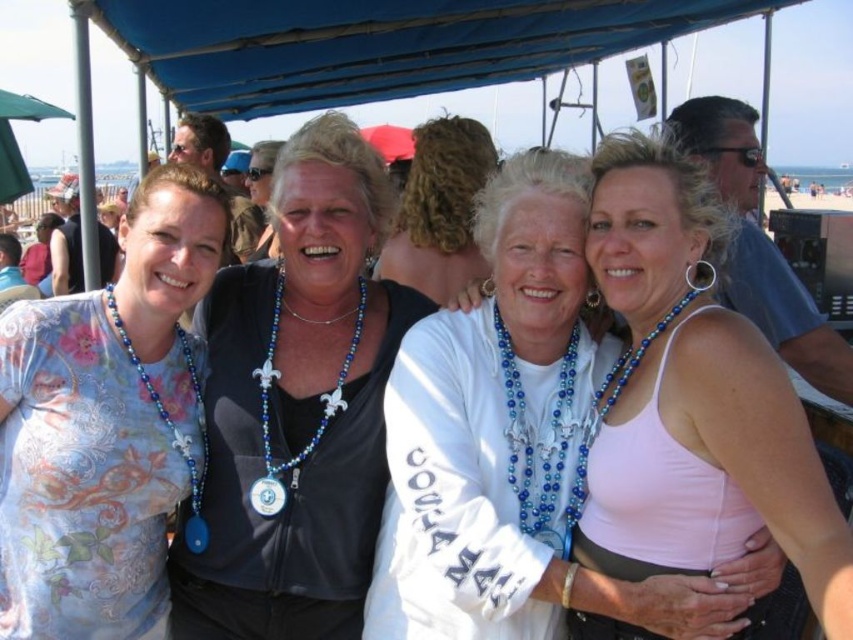
You are a photographer standing at the edge of the scene and want to capture a closeup shot of both the black leather jacket at center and the pink fabric tank top at center. Given that your camera has a maximum focus range of 50 feet, will you be able to focus on both subjects simultaneously?

Answer: The black leather jacket at center is 56.47 feet away from the pink fabric tank top at center. Since the distance between them exceeds the camera maximum focus range of 50 feet, you cannot focus on both subjects simultaneously.

You are a photographer at the beach event and want to ensure that the white matte shirt at center and the white fabric at center are both visible in your photo. Based on their positions, which object is wider and might require more space in the frame?

The white matte shirt at center might be wider than the white fabric at center according to the description, so it requires more space in the frame to ensure visibility.

You are a photographer trying to capture a group photo of the floral printed shirt at left and the blue beaded necklace at right. Given that your camera has a maximum focus range of 90 feet, will you be able to include both subjects in a single clear shot?

The distance between the floral printed shirt at left and the blue beaded necklace at right is 88.67 feet, which is within the camera maximum focus range of 90 feet. Therefore, you can capture both subjects in a single clear shot.